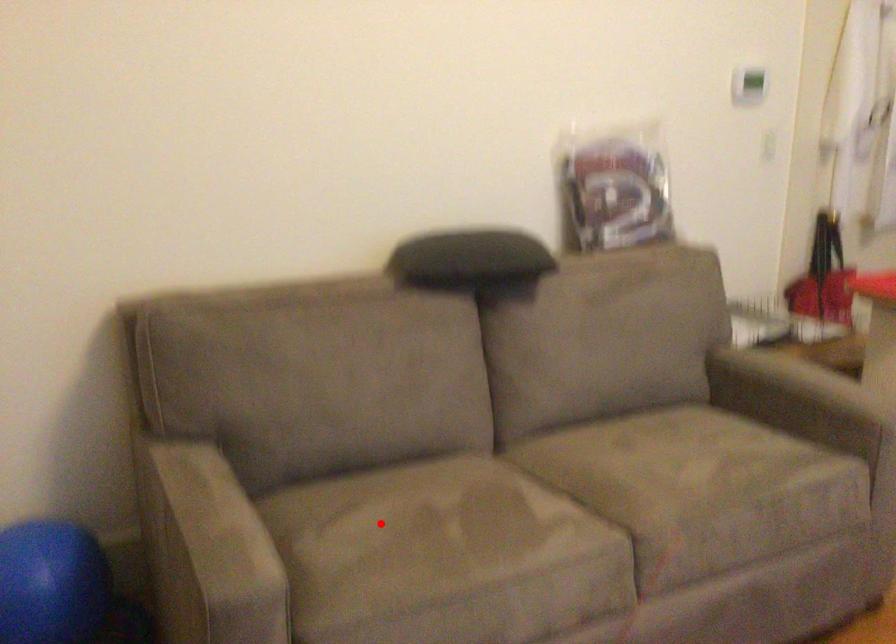
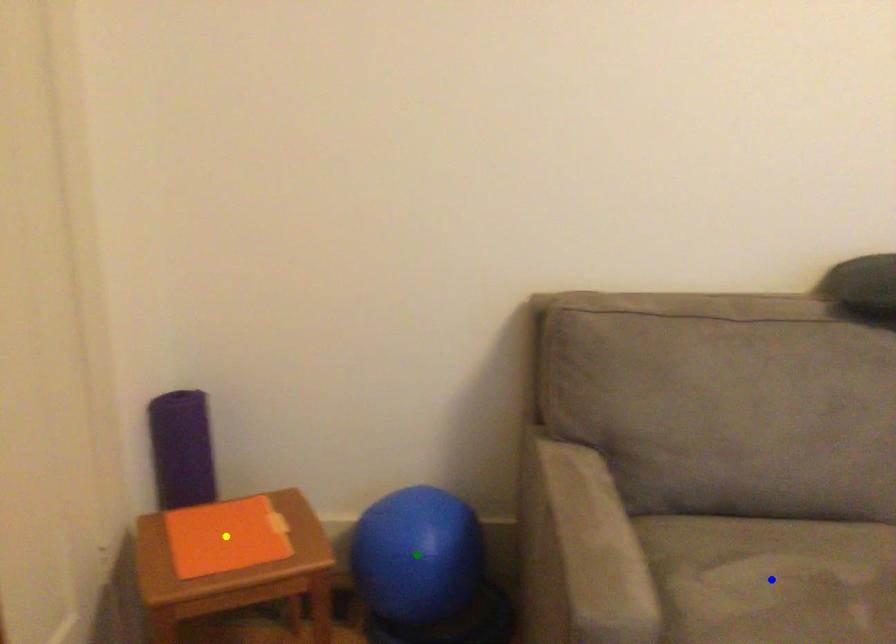
Question: I am providing you with two images of the same scene from different viewpoints. A red point is marked on the first image. You are given multiple points on the second image. Which spot in image 2 lines up with the point in image 1?

Choices:
 (A) yellow point
 (B) blue point
 (C) green point

Answer: (B)